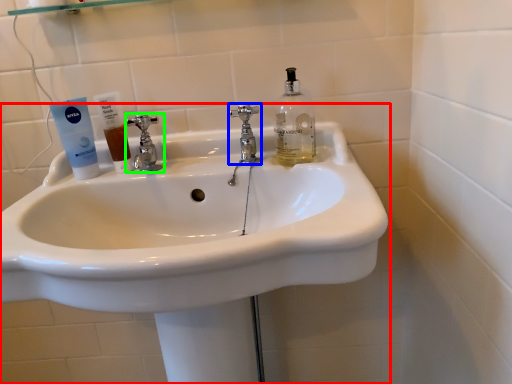
Question: Estimate the real-world distances between objects in this image. Which object is closer to sink (highlighted by a red box), tap (highlighted by a blue box) or tap (highlighted by a green box)?

Choices:
 (A) tap
 (B) tap

Answer: (A)